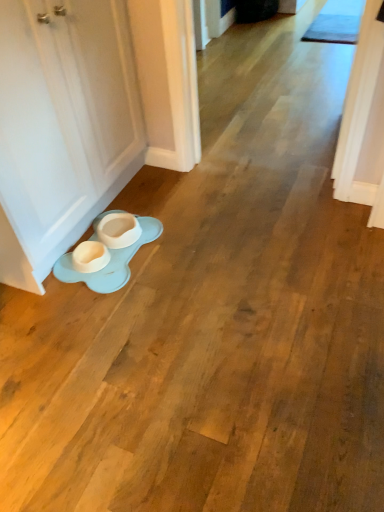
Where is `vacant space behind light blue rubber saucer at lower left`? vacant space behind light blue rubber saucer at lower left is located at coordinates (136, 195).